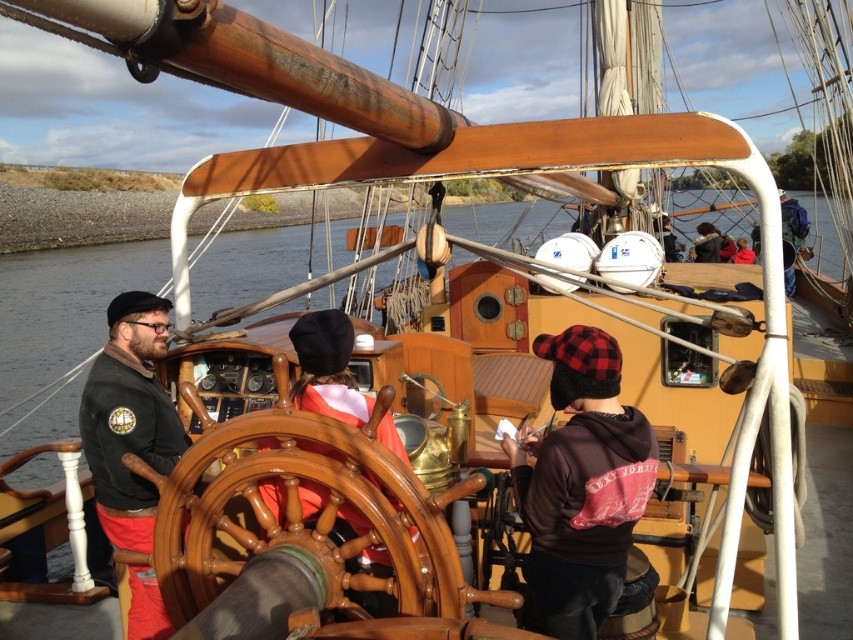
Does brown leather hat at center lie in front of wooden helm at center?

No.

Does point (560, 529) come closer to viewer compared to point (329, 372)?

That is True.

Who is more distant from viewer, (x=527, y=492) or (x=317, y=368)?

The point (x=317, y=368) is more distant.

This screenshot has height=640, width=853. I want to click on brown leather hat at center, so click(x=581, y=484).

Who is taller, shiny brown wooden wheel at center or wooden helm at center?

With more height is wooden helm at center.

Does shiny brown wooden wheel at center appear on the left side of wooden helm at center?

Correct, you'll find shiny brown wooden wheel at center to the left of wooden helm at center.

Between point (357, 582) and point (331, 394), which one is positioned behind?

The point (331, 394) is behind.

This screenshot has width=853, height=640. In order to click on shiny brown wooden wheel at center in this screenshot , I will do `click(315, 522)`.

Is shiny brown wooden wheel at center to the left of brown leather hat at center from the viewer's perspective?

Yes, shiny brown wooden wheel at center is to the left of brown leather hat at center.

Which is more to the left, shiny brown wooden wheel at center or brown leather hat at center?

From the viewer's perspective, shiny brown wooden wheel at center appears more on the left side.

You are a GUI agent. You are given a task and a screenshot of the screen. Output one action in this format:
    pyautogui.click(x=<x>, y=<y>)
    Task: Click on the shiny brown wooden wheel at center
    The height and width of the screenshot is (640, 853).
    Given the screenshot: What is the action you would take?
    pyautogui.click(x=315, y=522)

The height and width of the screenshot is (640, 853). I want to click on shiny brown wooden wheel at center, so click(315, 522).